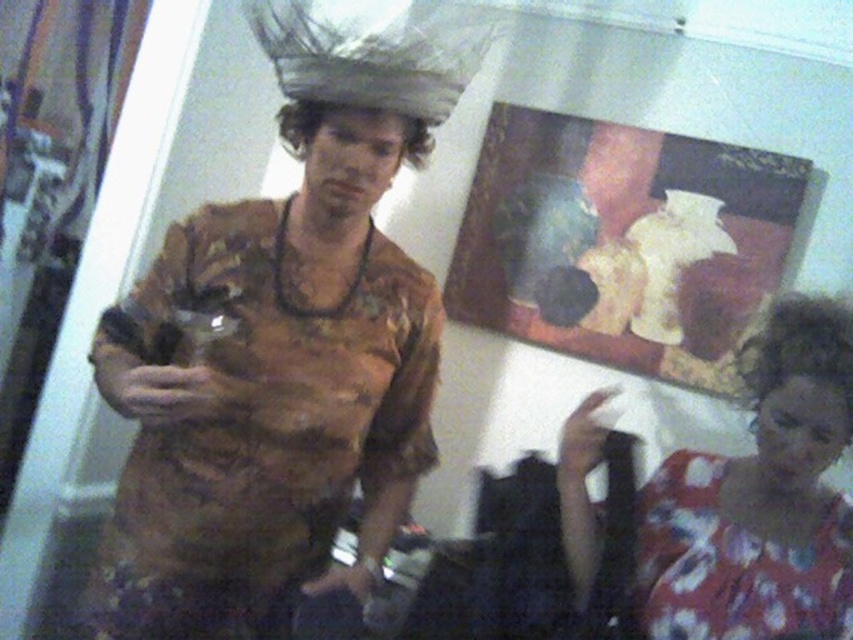
Question: Does matte brown shirt at center have a greater width compared to floral fabric blouse at lower right?

Choices:
 (A) no
 (B) yes

Answer: (B)

Question: Can you confirm if matte brown shirt at center is smaller than floral fabric blouse at lower right?

Choices:
 (A) no
 (B) yes

Answer: (A)

Question: Which object is closer to the camera taking this photo?

Choices:
 (A) curly brown hair at lower right
 (B) shiny metallic headband at center
 (C) matte brown shirt at center
 (D) floral fabric blouse at lower right

Answer: (C)

Question: Is curly brown hair at lower right above shiny metallic headband at center?

Choices:
 (A) yes
 (B) no

Answer: (B)

Question: Which object is the farthest from the curly brown hair at lower right?

Choices:
 (A) floral fabric blouse at lower right
 (B) shiny metallic headband at center
 (C) matte brown shirt at center

Answer: (C)

Question: Among these points, which one is farthest from the camera?

Choices:
 (A) (810, 364)
 (B) (763, 548)
 (C) (192, 278)

Answer: (B)